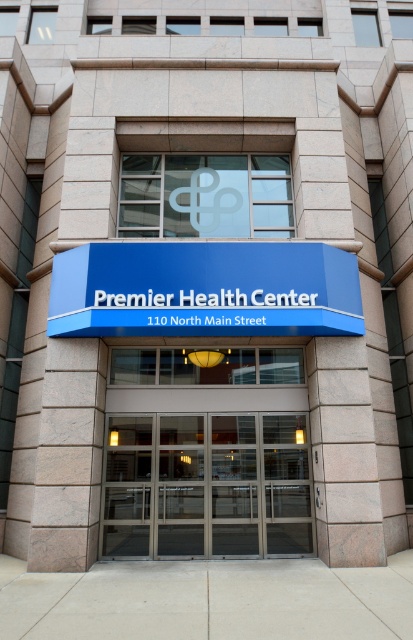
Question: Which of the following is the farthest from the observer?

Choices:
 (A) blue plastic sign at center
 (B) metallic glass doors at center

Answer: (B)

Question: Among these points, which one is nearest to the camera?

Choices:
 (A) (239, 260)
 (B) (242, 465)

Answer: (A)

Question: Does metallic glass doors at center appear over blue plastic sign at center?

Choices:
 (A) yes
 (B) no

Answer: (B)

Question: Which object is closer to the camera taking this photo?

Choices:
 (A) metallic glass doors at center
 (B) blue plastic sign at center

Answer: (B)

Question: Is metallic glass doors at center further to camera compared to blue plastic sign at center?

Choices:
 (A) no
 (B) yes

Answer: (B)

Question: Does metallic glass doors at center appear on the right side of blue plastic sign at center?

Choices:
 (A) no
 (B) yes

Answer: (B)